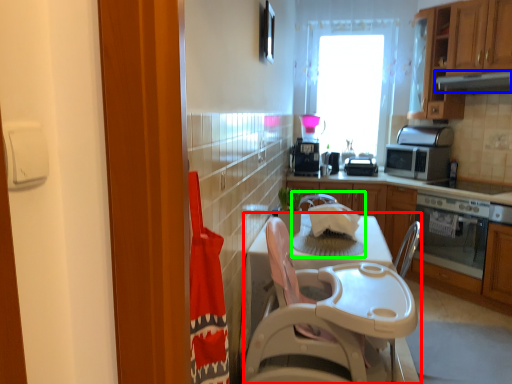
Question: Estimate the real-world distances between objects in this image. Which object is farther from table (highlighted by a red box), exhaust hood (highlighted by a blue box) or sink (highlighted by a green box)?

Choices:
 (A) exhaust hood
 (B) sink

Answer: (A)